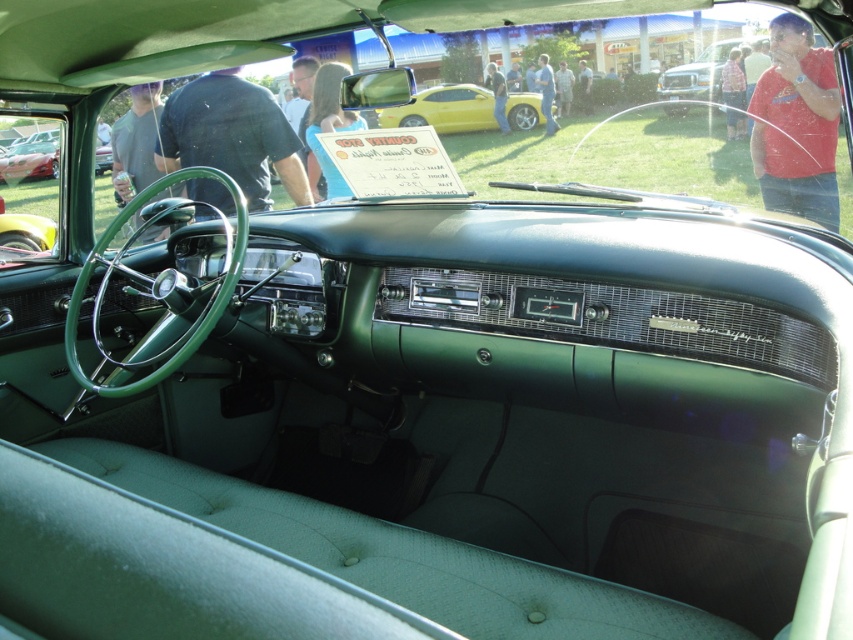
Can you confirm if yellow metallic car at center is thinner than shiny red car at left?

In fact, yellow metallic car at center might be wider than shiny red car at left.

Who is more forward, (456, 86) or (0, 160)?

Point (456, 86) is in front.

What are the coordinates of `yellow metallic car at center` in the screenshot? It's located at (444, 109).

Can you confirm if metallic silver truck at upper center is positioned to the left of shiny red car at left?

No, metallic silver truck at upper center is not to the left of shiny red car at left.

Can you confirm if metallic silver truck at upper center is smaller than shiny red car at left?

Incorrect, metallic silver truck at upper center is not smaller in size than shiny red car at left.

Who is more forward, (744, 49) or (38, 163)?

Point (744, 49)

Where is `metallic silver truck at upper center`? metallic silver truck at upper center is located at coordinates (695, 77).

Who is lower down, yellow metallic car at center or metallic silver truck at upper center?

yellow metallic car at center

Between yellow metallic car at center and metallic silver truck at upper center, which one has less height?

metallic silver truck at upper center is shorter.

Is point (520, 128) more distant than point (735, 48)?

Yes, point (520, 128) is farther from viewer.

I want to click on yellow metallic car at center, so click(444, 109).